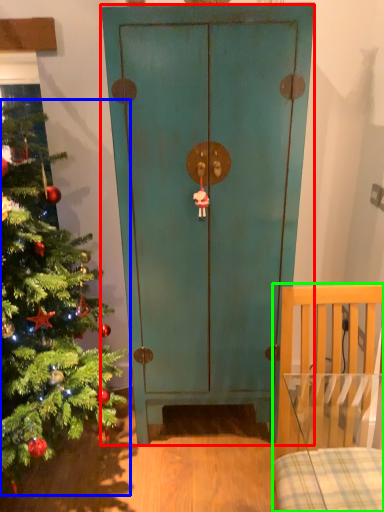
Question: Which object is positioned farthest from door (highlighted by a red box)? Select from christmas tree (highlighted by a blue box) and furniture (highlighted by a green box).

Choices:
 (A) christmas tree
 (B) furniture

Answer: (B)